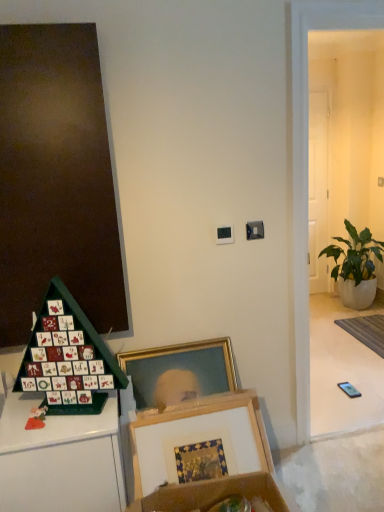
Question: Choose the correct answer: Is green leafy plant in white pot at right inside gray woven mat at lower right or outside it?

Choices:
 (A) inside
 (B) outside

Answer: (B)

Question: Considering their positions, is green leafy plant in white pot at right located in front of or behind gray woven mat at lower right?

Choices:
 (A) behind
 (B) front

Answer: (A)

Question: Which of these objects is positioned farthest from the green leafy plant in white pot at right?

Choices:
 (A) green cardboard advent calendar at lower left
 (B) white glossy door at right
 (C) gray woven mat at lower right
 (D) wooden picture frame at lower center

Answer: (A)

Question: Estimate the real-world distances between objects in this image. Which object is farther from the green cardboard advent calendar at lower left?

Choices:
 (A) gray woven mat at lower right
 (B) green leafy plant in white pot at right
 (C) white glossy door at right
 (D) wooden picture frame at lower center

Answer: (C)